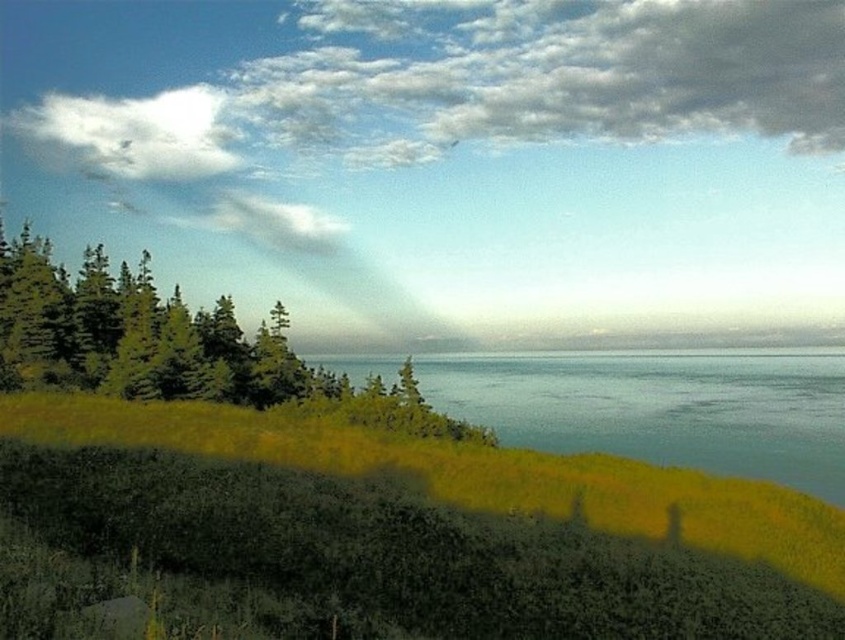
Question: Can you confirm if green grassy hillside at lower left is positioned below green matte trees at left?

Choices:
 (A) no
 (B) yes

Answer: (B)

Question: Which object appears closest to the camera in this image?

Choices:
 (A) white fluffy cloud at upper left
 (B) green matte trees at left
 (C) greenish-blue water at center
 (D) green grassy hillside at lower left

Answer: (D)

Question: Which object is positioned farthest from the white fluffy cloud at upper left?

Choices:
 (A) green matte trees at left
 (B) green grassy hillside at lower left
 (C) greenish-blue water at center

Answer: (B)

Question: Is green grassy hillside at lower left bigger than white fluffy cloud at upper left?

Choices:
 (A) no
 (B) yes

Answer: (A)

Question: Does green grassy hillside at lower left come in front of white fluffy cloud at upper left?

Choices:
 (A) no
 (B) yes

Answer: (B)

Question: Among these points, which one is farthest from the camera?

Choices:
 (A) (166, 168)
 (B) (336, 444)
 (C) (259, 362)

Answer: (A)